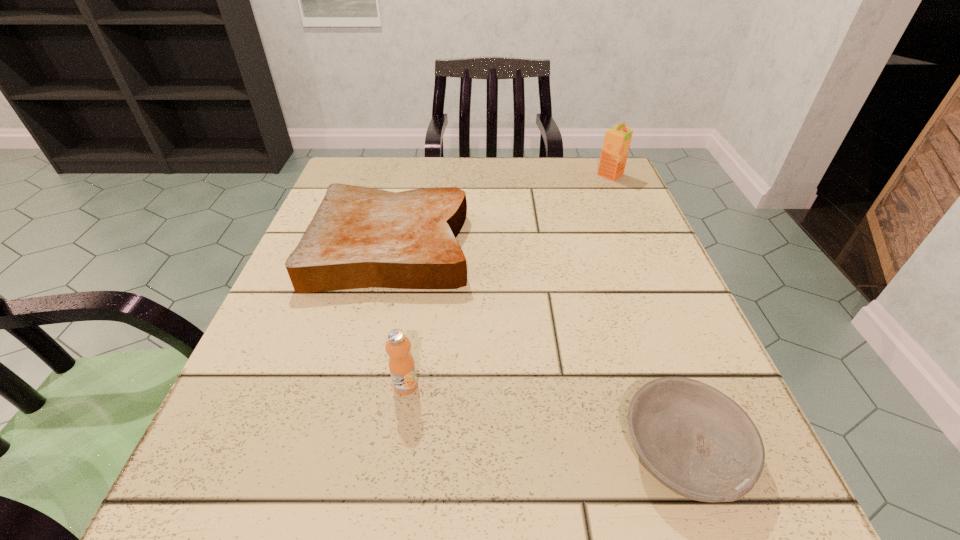
What are the coordinates of `object at the near right corner` in the screenshot? It's located at (698, 442).

Find the location of a particular element. The height and width of the screenshot is (540, 960). vacant region at the far edge of the desktop is located at coordinates (537, 188).

Image resolution: width=960 pixels, height=540 pixels. What are the coordinates of `free space at the near edge` in the screenshot? It's located at (445, 484).

Where is `vacant space at the left edge of the desktop`? vacant space at the left edge of the desktop is located at coordinates (325, 346).

You are a GUI agent. You are given a task and a screenshot of the screen. Output one action in this format:
    pyautogui.click(x=<x>, y=<y>)
    Task: Click on the vacant area at the right edge
    The height and width of the screenshot is (540, 960).
    Given the screenshot: What is the action you would take?
    pyautogui.click(x=609, y=263)

Where is `vacant area at the far left corner of the desktop`? vacant area at the far left corner of the desktop is located at coordinates (341, 167).

Locate an element on the screen. blank space at the far right corner of the desktop is located at coordinates pos(562,180).

This screenshot has width=960, height=540. I want to click on vacant space at the near right corner, so click(693, 530).

Identify the location of vacant space that's between the second shortest object and the nearest object. coord(538,348).

Locate an element on the screen. free space between the nearest object and the nearer orange juice is located at coordinates (544, 418).